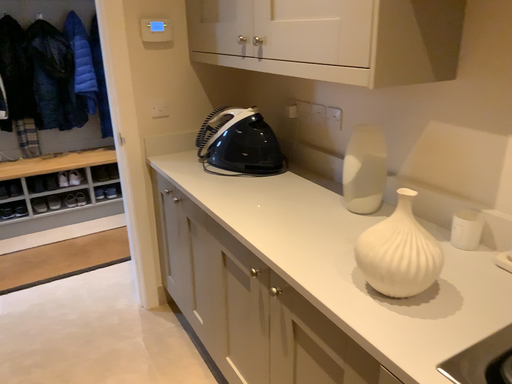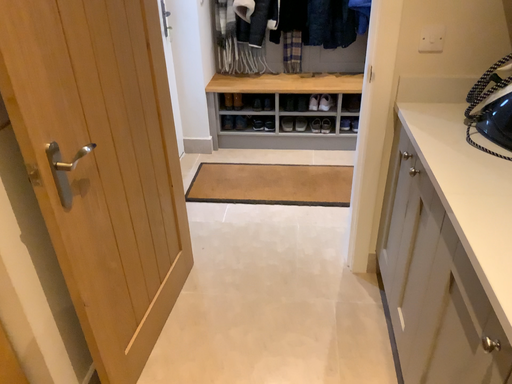
Question: Which way did the camera rotate in the video?

Choices:
 (A) rotated left
 (B) rotated right

Answer: (A)